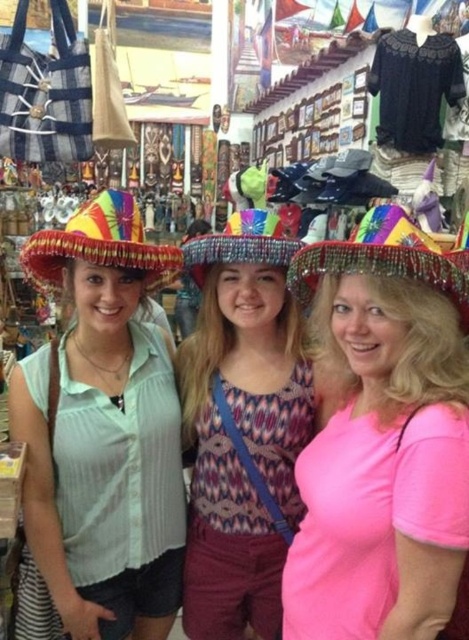
Can you confirm if rainbow beaded sombrero at center is positioned below rainbow fabric sombrero at left?

Yes.

Between point (318, 246) and point (68, 252), which one is positioned in front?

Point (318, 246)

Identify the location of rainbow beaded sombrero at center. (380, 257).

Can you confirm if matte fabric sombrero at left is wider than multicolored beaded hat at center?

Yes.

Can you confirm if matte fabric sombrero at left is thinner than multicolored beaded hat at center?

In fact, matte fabric sombrero at left might be wider than multicolored beaded hat at center.

Where is `matte fabric sombrero at left`? This screenshot has width=469, height=640. matte fabric sombrero at left is located at coordinates (104, 429).

Image resolution: width=469 pixels, height=640 pixels. I want to click on matte fabric sombrero at left, so click(x=104, y=429).

Is point (325, 400) less distant than point (226, 257)?

No, (325, 400) is further to viewer.

Does shiny metallic sombrero at center have a smaller size compared to multicolored beaded hat at center?

Actually, shiny metallic sombrero at center might be larger than multicolored beaded hat at center.

What do you see at coordinates (381, 436) in the screenshot?
I see `shiny metallic sombrero at center` at bounding box center [381, 436].

Where is `shiny metallic sombrero at center`? shiny metallic sombrero at center is located at coordinates (381, 436).